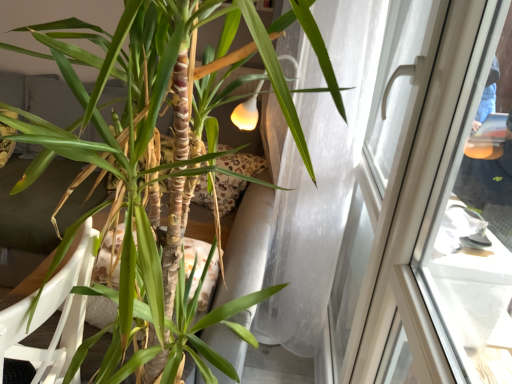
Question: From the image's perspective, is transparent glass window at upper right over white plastic armchair at lower left?

Choices:
 (A) no
 (B) yes

Answer: (B)

Question: From the image's perspective, is transparent glass window at upper right under white plastic armchair at lower left?

Choices:
 (A) no
 (B) yes

Answer: (A)

Question: From a real-world perspective, does transparent glass window at upper right stand above white plastic armchair at lower left?

Choices:
 (A) no
 (B) yes

Answer: (B)

Question: Is transparent glass window at upper right wider than white plastic armchair at lower left?

Choices:
 (A) yes
 (B) no

Answer: (B)

Question: Is transparent glass window at upper right turned away from white plastic armchair at lower left?

Choices:
 (A) yes
 (B) no

Answer: (B)

Question: Looking at their shapes, would you say transparent glass window at upper right is wider or thinner than white plastic armchair at lower left?

Choices:
 (A) wide
 (B) thin

Answer: (B)

Question: From a real-world perspective, is transparent glass window at upper right positioned above or below white plastic armchair at lower left?

Choices:
 (A) below
 (B) above

Answer: (B)

Question: Based on their sizes in the image, would you say transparent glass window at upper right is bigger or smaller than white plastic armchair at lower left?

Choices:
 (A) big
 (B) small

Answer: (B)

Question: Is transparent glass window at upper right situated inside white plastic armchair at lower left or outside?

Choices:
 (A) outside
 (B) inside

Answer: (A)

Question: Choose the correct answer: Is green matte plant at center inside transparent glass window at upper right or outside it?

Choices:
 (A) inside
 (B) outside

Answer: (B)

Question: Looking at the image, does green matte plant at center seem bigger or smaller compared to transparent glass window at upper right?

Choices:
 (A) small
 (B) big

Answer: (B)

Question: Is green matte plant at center taller or shorter than transparent glass window at upper right?

Choices:
 (A) short
 (B) tall

Answer: (A)

Question: Is point (150, 183) closer or farther from the camera than point (372, 377)?

Choices:
 (A) farther
 (B) closer

Answer: (B)

Question: Based on their positions, is white plastic armchair at lower left located to the left or right of green matte plant at center?

Choices:
 (A) left
 (B) right

Answer: (A)

Question: From the image's perspective, is white plastic armchair at lower left above or below green matte plant at center?

Choices:
 (A) above
 (B) below

Answer: (B)